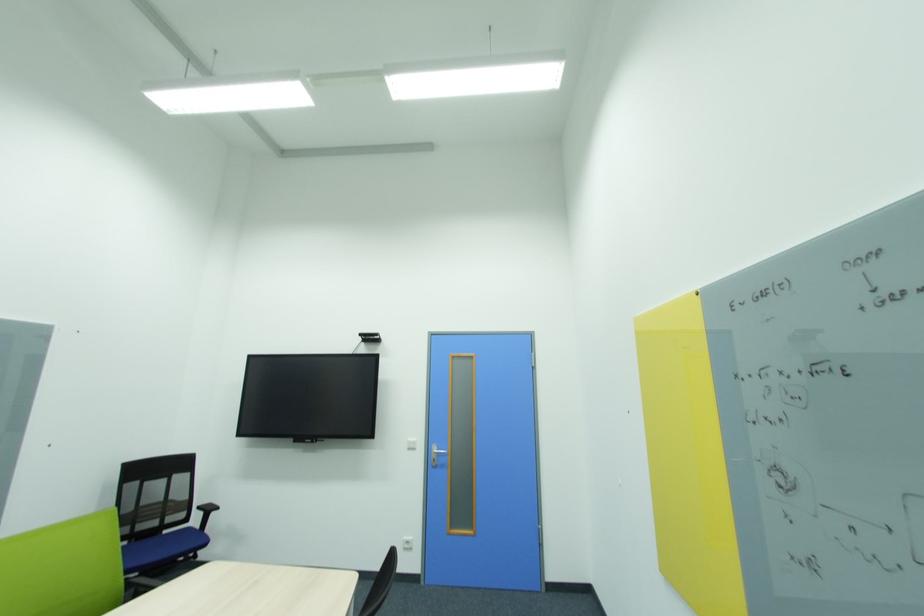
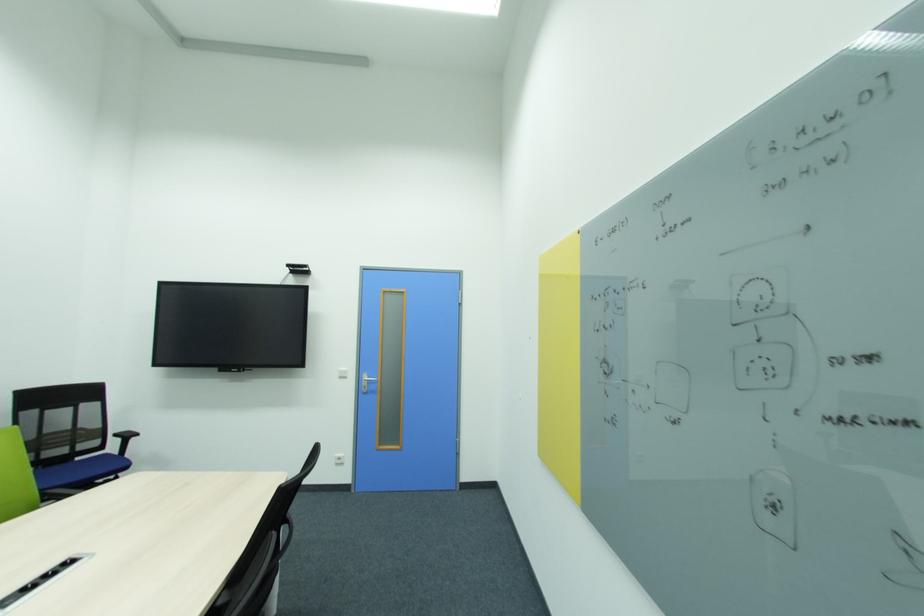
In the second image, find the point that corresponds to the point at 171,533 in the first image.

(82, 460)